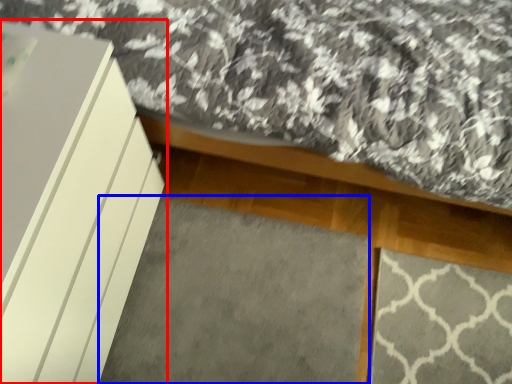
Question: Among these objects, which one is nearest to the camera, furniture (highlighted by a red box) or mat (highlighted by a blue box)?

Choices:
 (A) furniture
 (B) mat

Answer: (A)